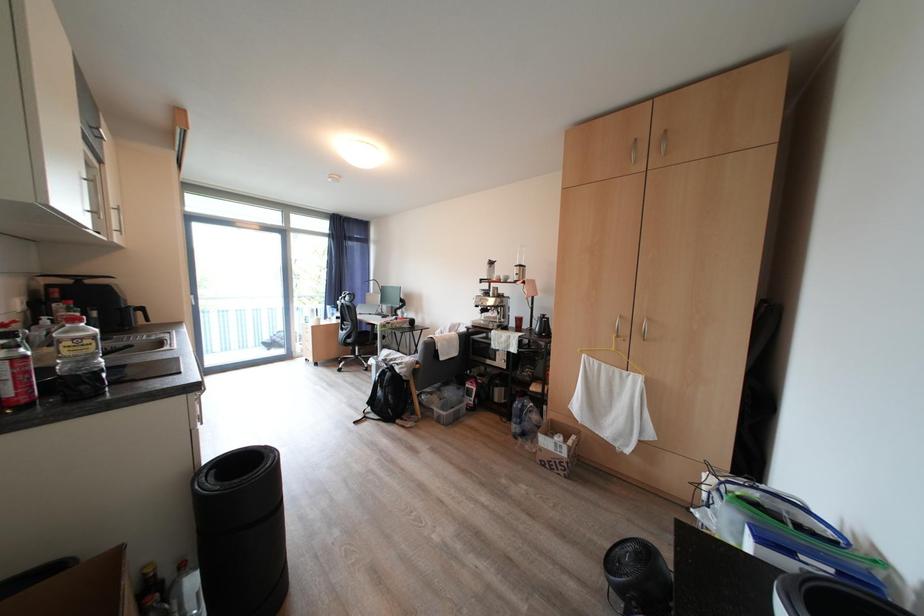
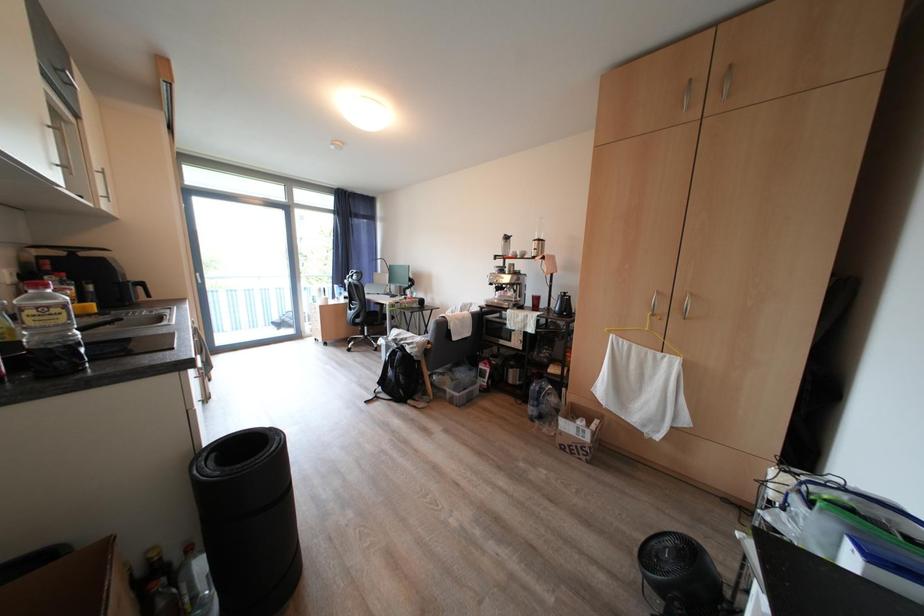
Question: Based on the continuous images, in which direction is the camera rotating? Reply with the corresponding letter.

Choices:
 (A) Left
 (B) Right
 (C) Up
 (D) Down

Answer: (D)